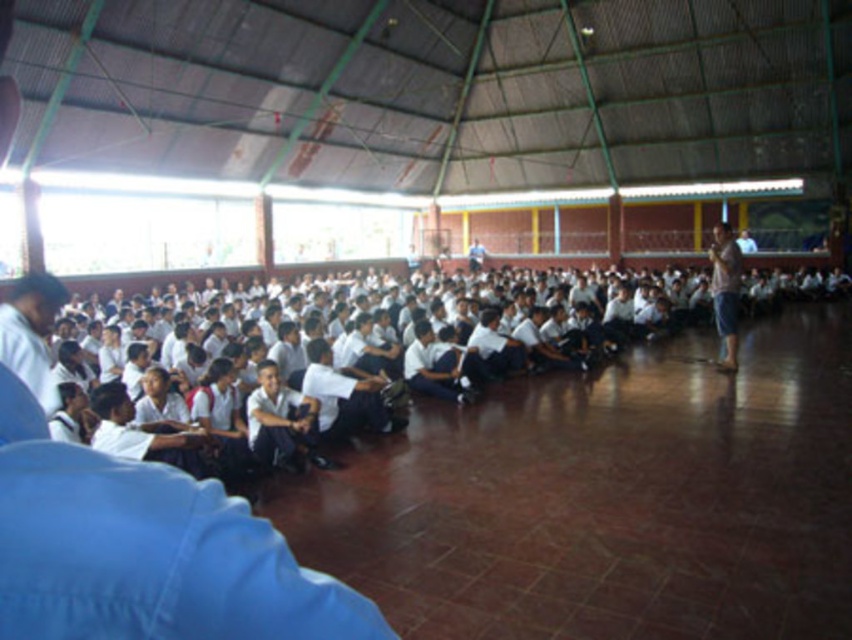
Who is positioned more to the right, blue fabric shirt at left or light brown wooden podium at right?

Positioned to the right is light brown wooden podium at right.

Which is behind, point (18, 308) or point (712, 264)?

Point (712, 264)

Which is in front, point (59, 294) or point (717, 227)?

Positioned in front is point (59, 294).

The image size is (852, 640). What are the coordinates of `blue fabric shirt at left` in the screenshot? It's located at (x=32, y=333).